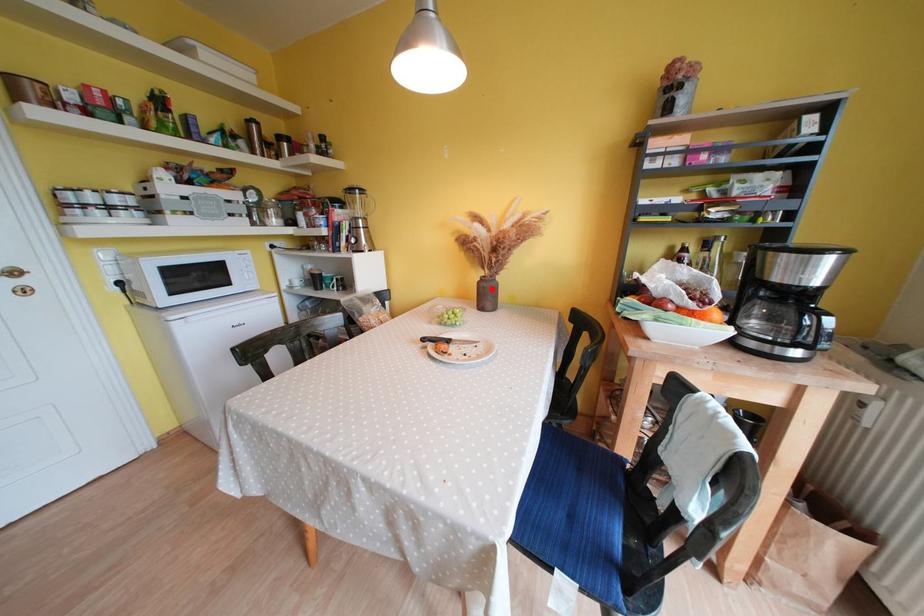
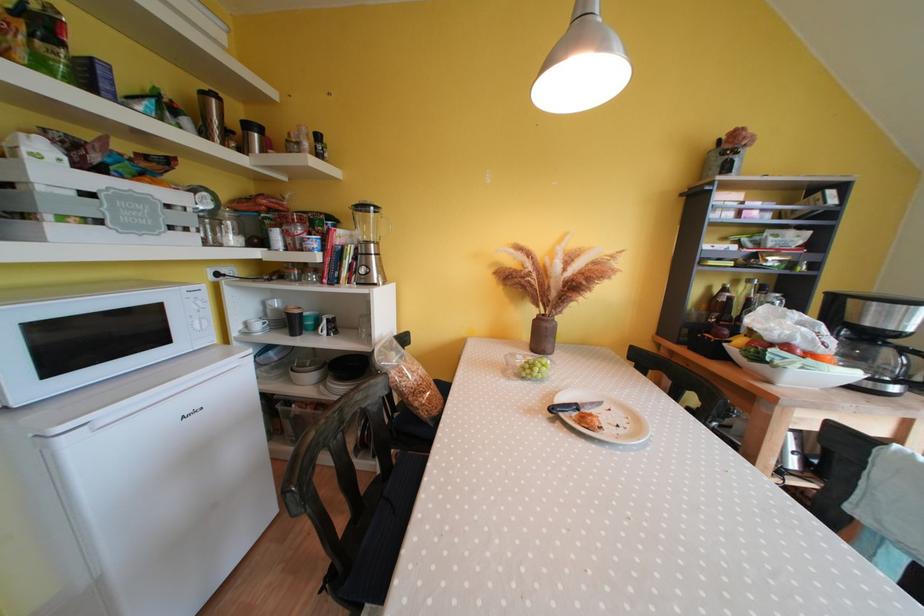
Question: I am providing you with two images of the same scene from different viewpoints. A red point is marked on the first image. At the location where the point appears in image 1, is it still visible in image 2?

Choices:
 (A) Yes
 (B) No

Answer: (A)